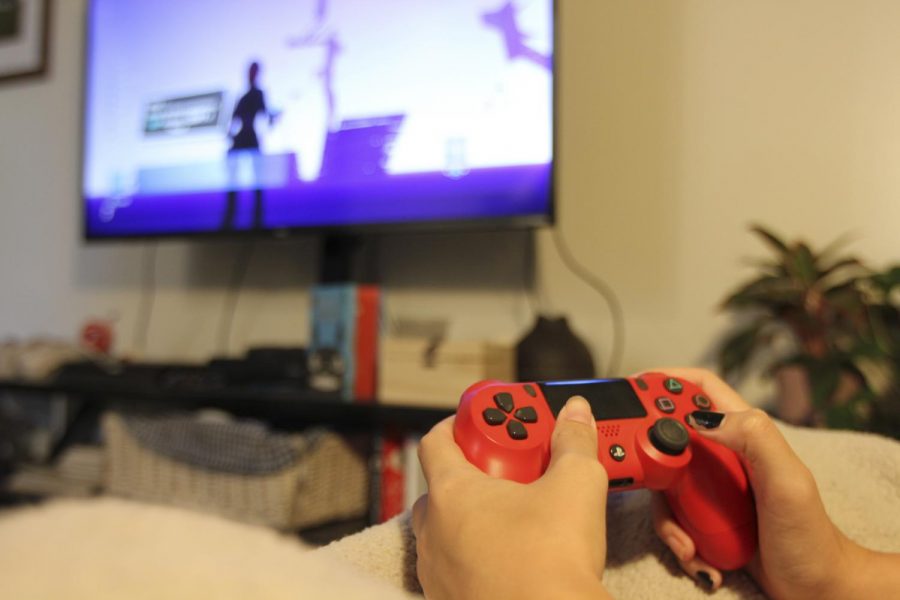
At what (x,y) coordinates should I click in order to perform the action: click on tv. Please return your answer as a coordinate pair (x, y). The height and width of the screenshot is (600, 900). Looking at the image, I should click on tap(427, 85).